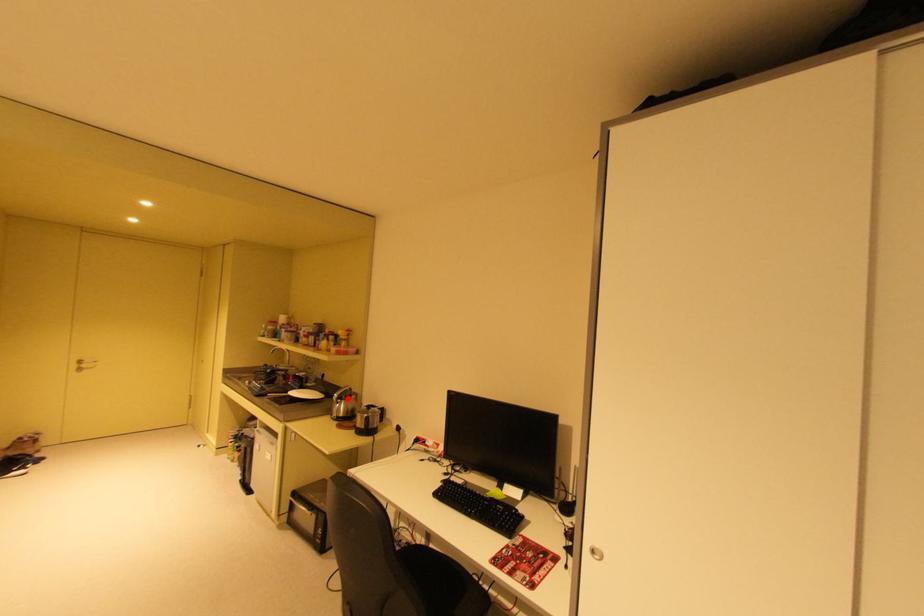
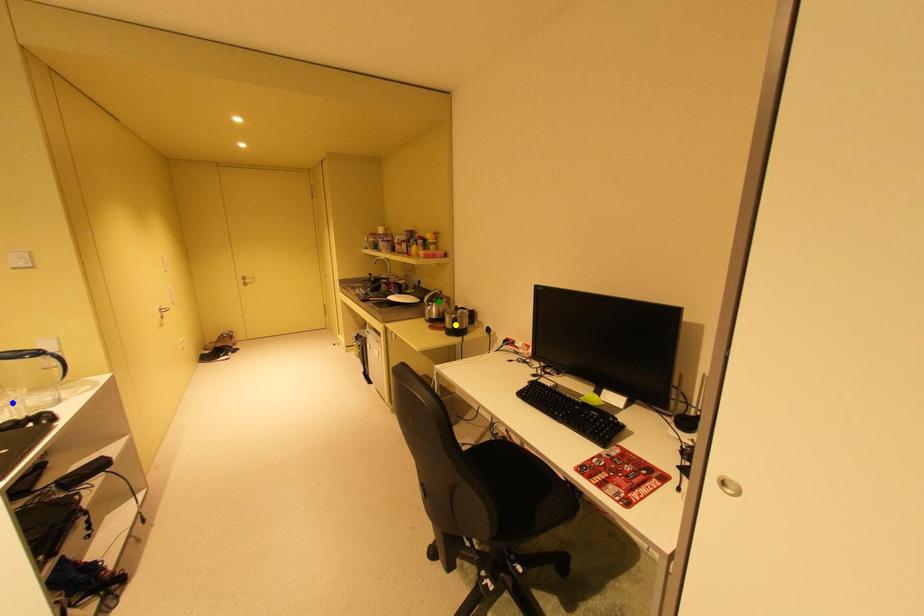
Question: I am providing you with two images of the same scene from different viewpoints. A red point is marked on the first image. You are given multiple points on the second image. Which spot in image 2 lines up with the point in image 1?

Choices:
 (A) yellow point
 (B) blue point
 (C) green point

Answer: (C)